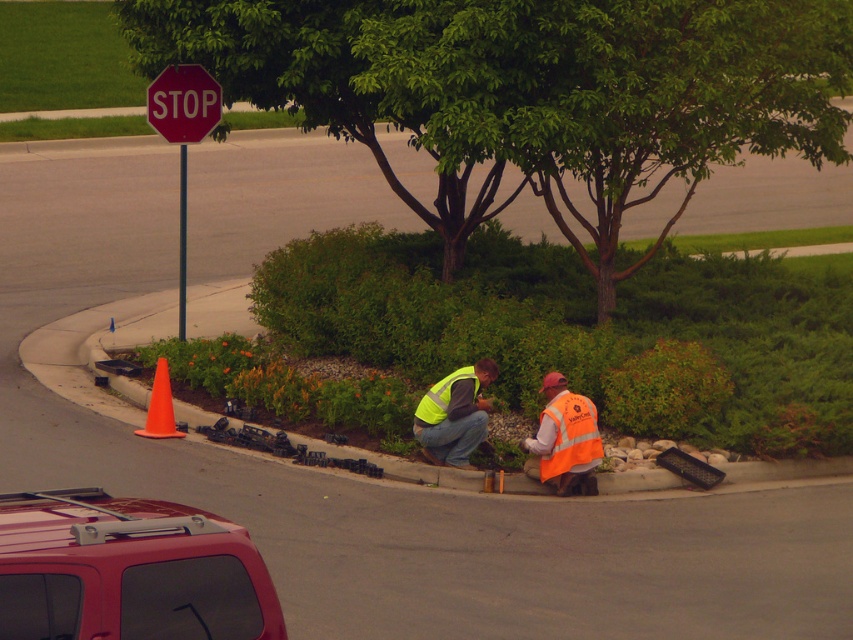
You are a pedestrian approaching the stop sign. There is a green leafy tree at upper center marked by point (531, 90). Which direction should you look to see the tree while standing at the stop sign?

The green leafy tree at upper center marked by point (531, 90) is located at the upper center of the image, so you should look upward from the stop sign to see it.